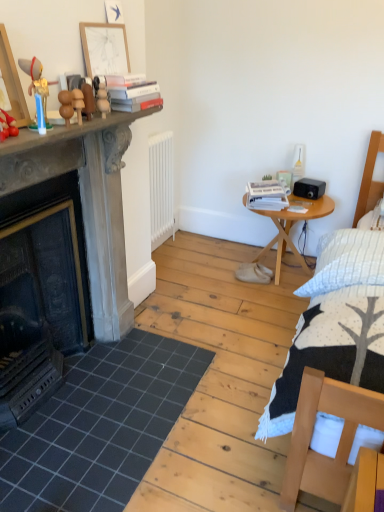
Question: From a real-world perspective, is hardcover books at upper center, marked as the second book in a bottom-to-top arrangement, on white matte radiator at center?

Choices:
 (A) yes
 (B) no

Answer: (A)

Question: Considering the relative positions of hardcover books at upper center, which is the 2th book from right to left, and white matte radiator at center in the image provided, is hardcover books at upper center, which is the 2th book from right to left, to the right of white matte radiator at center from the viewer's perspective?

Choices:
 (A) yes
 (B) no

Answer: (B)

Question: Is hardcover books at upper center, which appears as the second book when viewed from the back, thinner than white matte radiator at center?

Choices:
 (A) yes
 (B) no

Answer: (B)

Question: Can you confirm if hardcover books at upper center, placed as the first book when sorted from left to right, is bigger than white matte radiator at center?

Choices:
 (A) no
 (B) yes

Answer: (A)

Question: Does hardcover books at upper center, placed as the first book when sorted from left to right, have a greater height compared to white matte radiator at center?

Choices:
 (A) no
 (B) yes

Answer: (A)

Question: From the image's perspective, relative to wooden picture frame at upper center, which appears as the 1th picture frame when viewed from the right, is wooden round table at right above or below?

Choices:
 (A) above
 (B) below

Answer: (B)

Question: Is wooden round table at right in front of or behind wooden picture frame at upper center, which is the second picture frame in left-to-right order, in the image?

Choices:
 (A) behind
 (B) front

Answer: (A)

Question: From a real-world perspective, is wooden round table at right positioned above or below wooden picture frame at upper center, marked as the 1th picture frame in a top-to-bottom arrangement?

Choices:
 (A) above
 (B) below

Answer: (B)

Question: Is wooden round table at right taller or shorter than wooden picture frame at upper center, which is the 1th picture frame in back-to-front order?

Choices:
 (A) short
 (B) tall

Answer: (B)

Question: From the image's perspective, relative to white matte radiator at center, is hardcover books at upper center, which ranks as the first book in top-to-bottom order, above or below?

Choices:
 (A) above
 (B) below

Answer: (A)

Question: Visually, is hardcover books at upper center, which is the 2th book from right to left, positioned to the left or to the right of white matte radiator at center?

Choices:
 (A) left
 (B) right

Answer: (A)

Question: Is hardcover books at upper center, which is the 2th book from right to left, inside the boundaries of white matte radiator at center, or outside?

Choices:
 (A) inside
 (B) outside

Answer: (B)

Question: Looking at the image, does hardcover books at upper center, placed as the first book when sorted from left to right, seem bigger or smaller compared to white matte radiator at center?

Choices:
 (A) big
 (B) small

Answer: (B)

Question: Do you think wooden round table at right is within wooden balls at upper left, the second toy in the back-to-front sequence, or outside of it?

Choices:
 (A) outside
 (B) inside

Answer: (A)

Question: Does point (289, 237) appear closer or farther from the camera than point (61, 92)?

Choices:
 (A) closer
 (B) farther

Answer: (B)